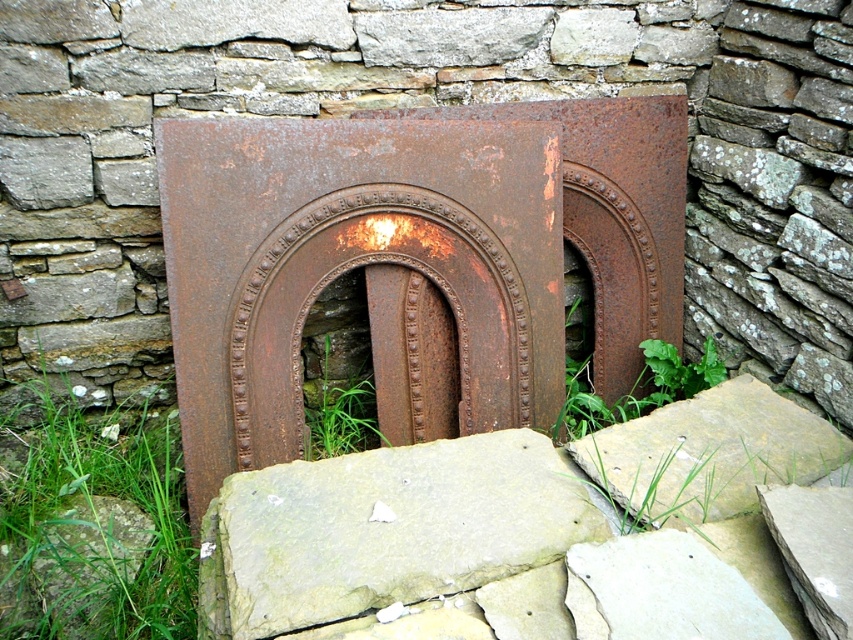
Question: Among these objects, which one is farthest from the camera?

Choices:
 (A) green grass at lower left
 (B) green grass at center

Answer: (B)

Question: Can you confirm if green grass at lower left is wider than green grass at center?

Choices:
 (A) no
 (B) yes

Answer: (B)

Question: Does green grass at lower left have a greater width compared to green grass at center?

Choices:
 (A) no
 (B) yes

Answer: (B)

Question: Does green grass at lower left appear on the left side of green grass at center?

Choices:
 (A) no
 (B) yes

Answer: (B)

Question: Which object is farther from the camera taking this photo?

Choices:
 (A) green grass at lower left
 (B) green grass at center

Answer: (B)